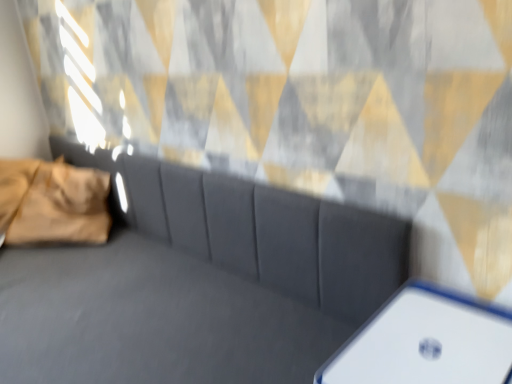
What are the coordinates of `vacant area on top of white plastic phone at lower right (from a real-world perspective)` in the screenshot? It's located at (430, 335).